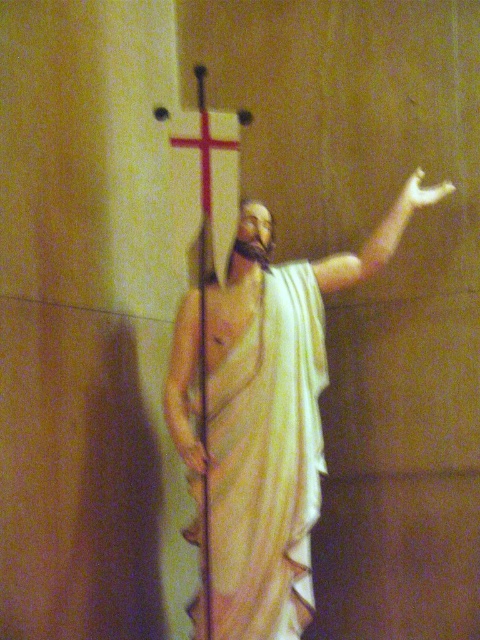
Question: Is matte white statue at center above red wood cross at center?

Choices:
 (A) no
 (B) yes

Answer: (A)

Question: Is matte white statue at center positioned before white draped cloth at center?

Choices:
 (A) no
 (B) yes

Answer: (A)

Question: Which point is closer to the camera taking this photo?

Choices:
 (A) (178, 138)
 (B) (278, 547)

Answer: (B)

Question: Among these objects, which one is nearest to the camera?

Choices:
 (A) matte white statue at center
 (B) red wood cross at center

Answer: (A)

Question: Does matte white statue at center lie behind white draped cloth at center?

Choices:
 (A) yes
 (B) no

Answer: (A)

Question: Which of the following is the farthest from the observer?

Choices:
 (A) white draped cloth at center
 (B) matte white statue at center

Answer: (B)